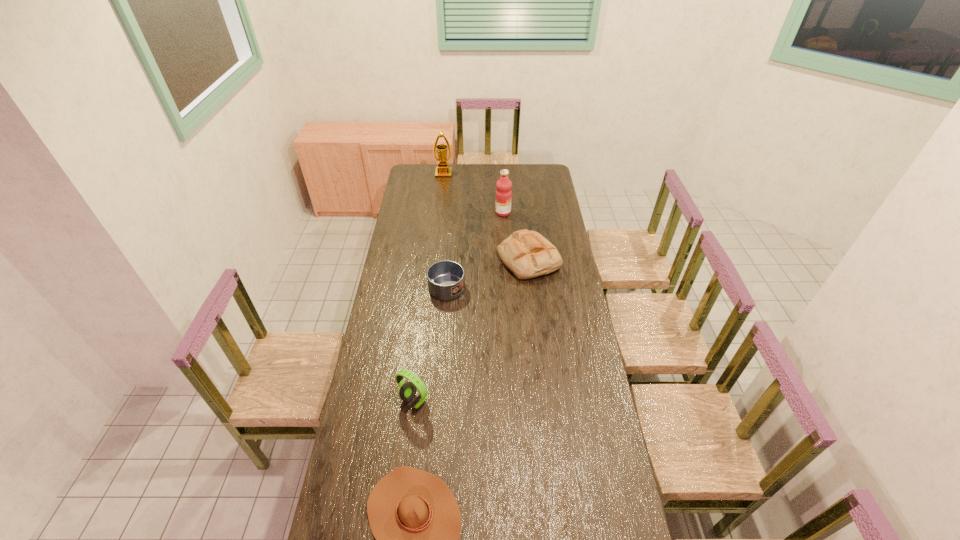
This screenshot has width=960, height=540. I want to click on free region located on the back of the second nearest object, so click(x=422, y=330).

Where is `free point located on the back of the third shortest object`? Image resolution: width=960 pixels, height=540 pixels. free point located on the back of the third shortest object is located at coordinates (522, 206).

Image resolution: width=960 pixels, height=540 pixels. Identify the location of vacant space located with the handle extending from one side of the fifth tallest object. [x=452, y=218].

Identify the location of blank space located 0.280m with the handle extending from one side of the fifth tallest object. Image resolution: width=960 pixels, height=540 pixels. (452, 214).

Where is `free point located 0.360m with the handle extending from one side of the fifth tallest object`? free point located 0.360m with the handle extending from one side of the fifth tallest object is located at coordinates (453, 206).

Where is `object located in the far edge section of the desktop`? This screenshot has width=960, height=540. object located in the far edge section of the desktop is located at coordinates (443, 171).

Find the location of a particular element. object positioned at the left edge is located at coordinates (407, 391).

In order to click on object present at the right edge in this screenshot , I will do `click(527, 254)`.

The width and height of the screenshot is (960, 540). I want to click on vacant space at the far edge of the desktop, so click(x=481, y=184).

The width and height of the screenshot is (960, 540). In the image, there is a desktop. In order to click on vacant area at the left edge in this screenshot , I will do `click(385, 287)`.